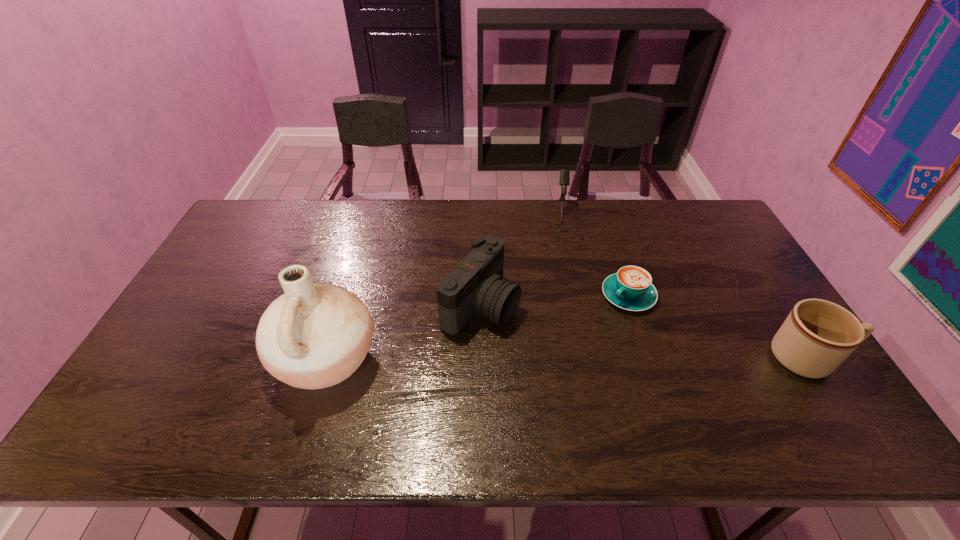
Select which object is the third closest to the farthest object. Please provide its 2D coordinates. Your answer should be formatted as a tuple, i.e. [(x, y)], where the tuple contains the x and y coordinates of a point satisfying the conditions above.

[(818, 335)]

Find the location of a particular element. The image size is (960, 540). free spot that satisfies the following two spatial constraints: 1. on the front side of the shortest object; 2. on the right side of the microphone is located at coordinates (576, 295).